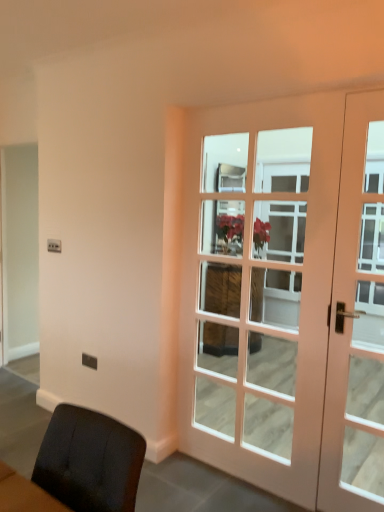
What are the coordinates of `matte white door at right, which is the 1th door from right to left` in the screenshot? It's located at tap(357, 321).

Describe the element at coordinates (357, 321) in the screenshot. This screenshot has width=384, height=512. I see `matte white door at right, positioned as the second door in left-to-right order` at that location.

Identify the location of white wood door at right, the 2th door viewed from the right. coord(287,297).

Describe the element at coordinates (287, 297) in the screenshot. I see `white wood door at right, the 2th door viewed from the right` at that location.

What is the approximate height of white wood door at right, the 2th door viewed from the right?

6.87 feet.

The height and width of the screenshot is (512, 384). I want to click on matte white door at right, which is the 1th door from right to left, so click(357, 321).

In the scene shown: Is matte white door at right, positioned as the second door in left-to-right order, to the left or to the right of white wood door at right, the first door viewed from the left, in the image?

matte white door at right, positioned as the second door in left-to-right order, is to the right of white wood door at right, the first door viewed from the left.

Which object is more forward, matte white door at right, positioned as the second door in left-to-right order, or white wood door at right, the 2th door viewed from the right?

Positioned in front is white wood door at right, the 2th door viewed from the right.

Which is closer to the camera, (339, 195) or (383, 155)?

The point (383, 155) is closer to the camera.

From the image's perspective, is matte white door at right, positioned as the second door in left-to-right order, above or below white wood door at right, the 2th door viewed from the right?

Based on their image positions, matte white door at right, positioned as the second door in left-to-right order, is located beneath white wood door at right, the 2th door viewed from the right.

From a real-world perspective, between matte white door at right, positioned as the second door in left-to-right order, and white wood door at right, the first door viewed from the left, who is vertically higher?

white wood door at right, the first door viewed from the left, from a real-world perspective.

Which object is thinner, matte white door at right, which is the 1th door from right to left, or white wood door at right, the 2th door viewed from the right?

matte white door at right, which is the 1th door from right to left.

Which of these two, matte white door at right, positioned as the second door in left-to-right order, or white wood door at right, the 2th door viewed from the right, stands shorter?

With less height is matte white door at right, positioned as the second door in left-to-right order.

Which of these two, matte white door at right, positioned as the second door in left-to-right order, or white wood door at right, the first door viewed from the left, is bigger?

white wood door at right, the first door viewed from the left, is bigger.

Would you say matte white door at right, which is the 1th door from right to left, is inside or outside white wood door at right, the first door viewed from the left?

The correct answer is: inside.

Is matte white door at right, positioned as the second door in left-to-right order, placed right next to white wood door at right, the 2th door viewed from the right?

No, matte white door at right, positioned as the second door in left-to-right order, is not next to white wood door at right, the 2th door viewed from the right.

Could you tell me if matte white door at right, positioned as the second door in left-to-right order, is facing white wood door at right, the 2th door viewed from the right?

Yes, matte white door at right, positioned as the second door in left-to-right order, is facing white wood door at right, the 2th door viewed from the right.

Identify the location of door that appears on the right of white wood door at right, the 2th door viewed from the right. The image size is (384, 512). (357, 321).

Considering the relative positions of white wood door at right, the first door viewed from the left, and matte white door at right, positioned as the second door in left-to-right order, in the image provided, is white wood door at right, the first door viewed from the left, to the right of matte white door at right, positioned as the second door in left-to-right order, from the viewer's perspective?

No.

Which is behind, white wood door at right, the first door viewed from the left, or matte white door at right, which is the 1th door from right to left?

matte white door at right, which is the 1th door from right to left, is further away from the camera.

Is point (211, 151) more distant than point (365, 175)?

That is True.

From the image's perspective, between white wood door at right, the first door viewed from the left, and matte white door at right, positioned as the second door in left-to-right order, who is located below?

matte white door at right, positioned as the second door in left-to-right order, is shown below in the image.

From a real-world perspective, is white wood door at right, the 2th door viewed from the right, over matte white door at right, which is the 1th door from right to left?

Correct, in the physical world, white wood door at right, the 2th door viewed from the right, is higher than matte white door at right, which is the 1th door from right to left.

In terms of width, does white wood door at right, the first door viewed from the left, look wider or thinner when compared to matte white door at right, positioned as the second door in left-to-right order?

Considering their sizes, white wood door at right, the first door viewed from the left, looks broader than matte white door at right, positioned as the second door in left-to-right order.

Considering the relative sizes of white wood door at right, the first door viewed from the left, and matte white door at right, positioned as the second door in left-to-right order, in the image provided, is white wood door at right, the first door viewed from the left, taller than matte white door at right, positioned as the second door in left-to-right order,?

Yes, white wood door at right, the first door viewed from the left, is taller than matte white door at right, positioned as the second door in left-to-right order.

Which of these two, white wood door at right, the first door viewed from the left, or matte white door at right, positioned as the second door in left-to-right order, is smaller?

With smaller size is matte white door at right, positioned as the second door in left-to-right order.

Is white wood door at right, the first door viewed from the left, surrounding matte white door at right, positioned as the second door in left-to-right order?

Indeed, matte white door at right, positioned as the second door in left-to-right order, is located within white wood door at right, the first door viewed from the left.

Is white wood door at right, the first door viewed from the left, positioned far away from matte white door at right, which is the 1th door from right to left?

No, white wood door at right, the first door viewed from the left, is not far from matte white door at right, which is the 1th door from right to left.

From the picture: Could you tell me if white wood door at right, the first door viewed from the left, is facing matte white door at right, positioned as the second door in left-to-right order?

Yes, white wood door at right, the first door viewed from the left, is aimed at matte white door at right, positioned as the second door in left-to-right order.

How different are the orientations of white wood door at right, the first door viewed from the left, and matte white door at right, positioned as the second door in left-to-right order, in degrees?

0.00263 degrees separate the facing orientations of white wood door at right, the first door viewed from the left, and matte white door at right, positioned as the second door in left-to-right order.

Could you measure the distance between white wood door at right, the first door viewed from the left, and matte white door at right, which is the 1th door from right to left?

white wood door at right, the first door viewed from the left, is 10.23 inches away from matte white door at right, which is the 1th door from right to left.

Locate an element on the screen. This screenshot has height=512, width=384. door behind the white wood door at right, the first door viewed from the left is located at coordinates (357, 321).

You are a GUI agent. You are given a task and a screenshot of the screen. Output one action in this format:
    pyautogui.click(x=<x>, y=<y>)
    Task: Click on the door located above the matte white door at right, which is the 1th door from right to left (from a real-world perspective)
    The image size is (384, 512).
    Given the screenshot: What is the action you would take?
    pyautogui.click(x=287, y=297)

The height and width of the screenshot is (512, 384). In order to click on door behind the white wood door at right, the 2th door viewed from the right in this screenshot , I will do `click(357, 321)`.